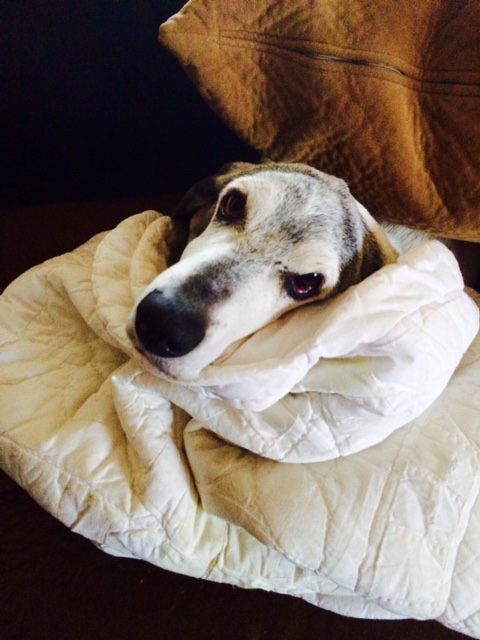
Where is `pillow`? This screenshot has height=640, width=480. pillow is located at coordinates (416, 128).